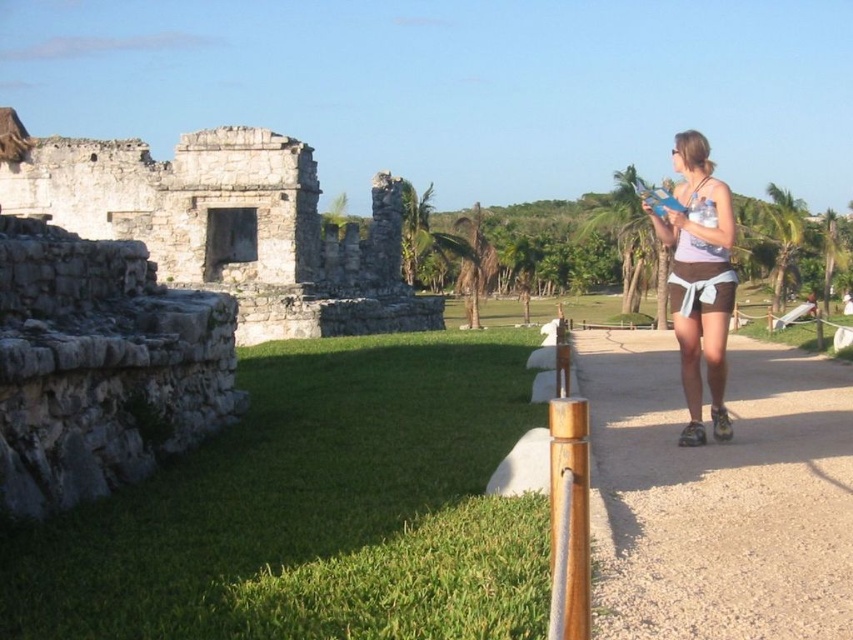
Which is behind, point (204, 275) or point (683, 285)?

The point (204, 275) is behind.

Between gray stone ruins at left and white fabric shorts at right, which one has more height?

With more height is white fabric shorts at right.

Where is `gray stone ruins at left`? gray stone ruins at left is located at coordinates (227, 225).

Locate an element on the screen. gray stone ruins at left is located at coordinates (227, 225).

Does brown gravel path at center appear over gray stone ruins at left?

No.

Consider the image. How distant is brown gravel path at center from gray stone ruins at left?

A distance of 40.83 meters exists between brown gravel path at center and gray stone ruins at left.

Describe the element at coordinates (718, 493) in the screenshot. I see `brown gravel path at center` at that location.

Locate an element on the screen. Image resolution: width=853 pixels, height=640 pixels. brown gravel path at center is located at coordinates (718, 493).

Locate an element on the screen. The image size is (853, 640). brown gravel path at center is located at coordinates (718, 493).

Does brown gravel path at center appear on the right side of white fabric shorts at right?

No, brown gravel path at center is not to the right of white fabric shorts at right.

The image size is (853, 640). What do you see at coordinates (718, 493) in the screenshot?
I see `brown gravel path at center` at bounding box center [718, 493].

At what (x,y) coordinates should I click in order to perform the action: click on brown gravel path at center. Please return your answer as a coordinate pair (x, y). This screenshot has width=853, height=640. Looking at the image, I should click on (718, 493).